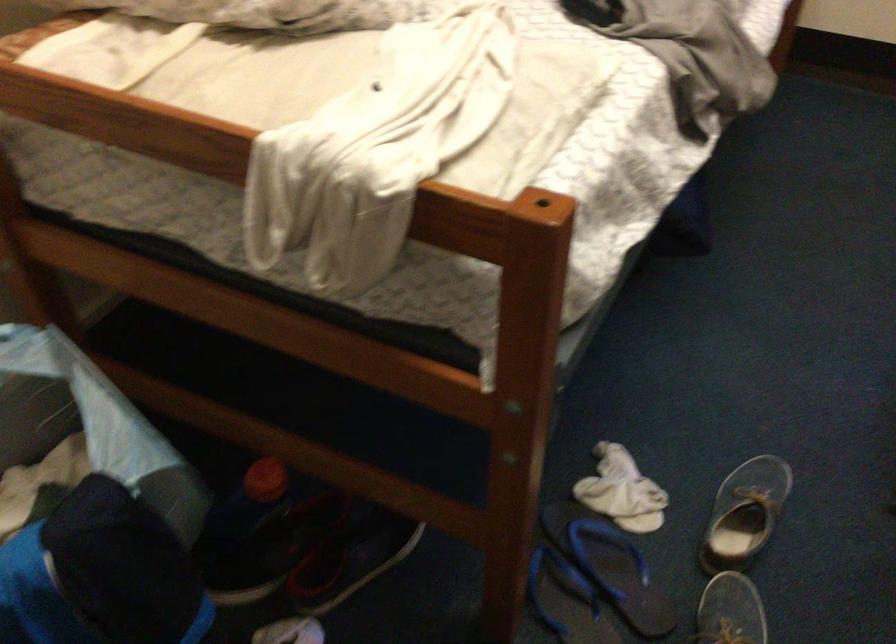
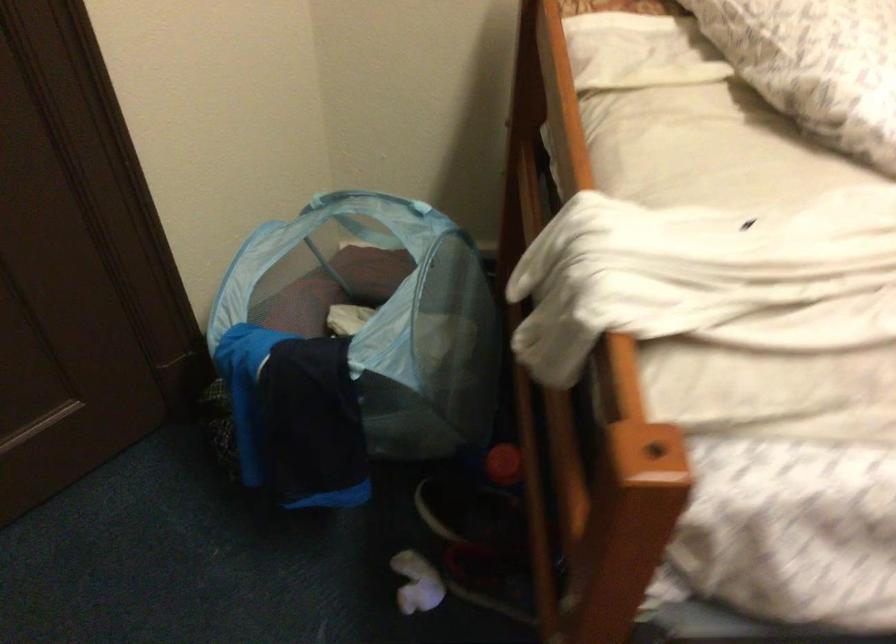
The images are taken continuously from a first-person perspective. In which direction is your viewpoint rotating?

The camera's rotation is toward left-down.